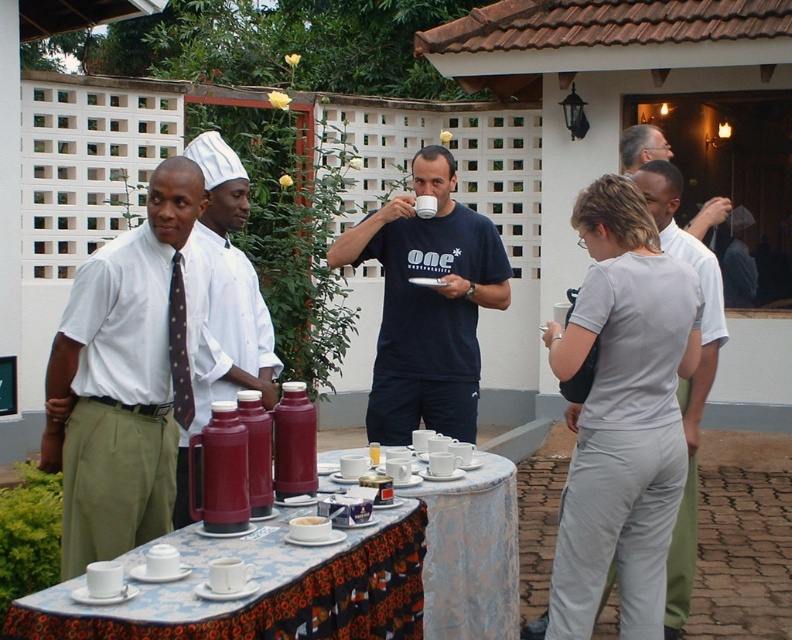
Question: Where is matte white shirt at left located in relation to burgundy thermos at center in the image?

Choices:
 (A) above
 (B) below

Answer: (A)

Question: Which point is closer to the camera?

Choices:
 (A) (143, 262)
 (B) (630, 156)

Answer: (A)

Question: Which point is closer to the camera taking this photo?

Choices:
 (A) (657, 144)
 (B) (284, 497)

Answer: (B)

Question: Is floral-patterned tablecloth at center further to the viewer compared to burgundy thermos at center?

Choices:
 (A) no
 (B) yes

Answer: (A)

Question: Does matte blue t-shirt at center appear on the right side of floral-patterned tablecloth at center?

Choices:
 (A) yes
 (B) no

Answer: (B)

Question: Which of these objects is positioned farthest from the white matte sugar at table center?

Choices:
 (A) blue printed fabric at lower center
 (B) floral-patterned tablecloth at center
 (C) gray cotton shirt at upper center

Answer: (C)